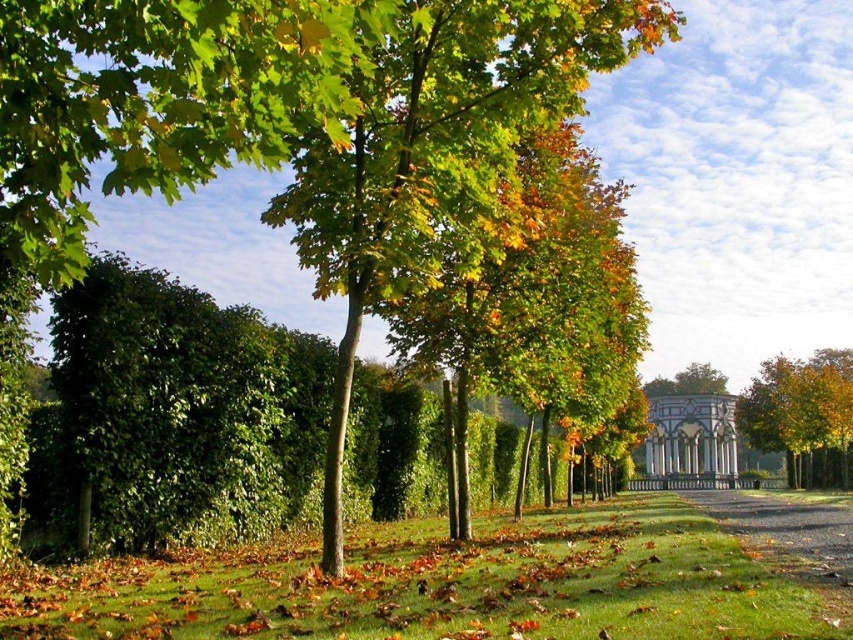
You are standing at the point labeled point (444,586) in the park scene. What type of ground surface are you currently standing on?

The point (444,586) is on green grass at center, so you are standing on green grass.

You are a gardener who wants to plant a new flower bed between the green leafy tree at center and the green grass at center. Considering their heights, which one should you place the flower bed closer to?

The green leafy tree at center is taller than the green grass at center, so you should place the flower bed closer to the green grass at center to avoid shading from the taller tree.